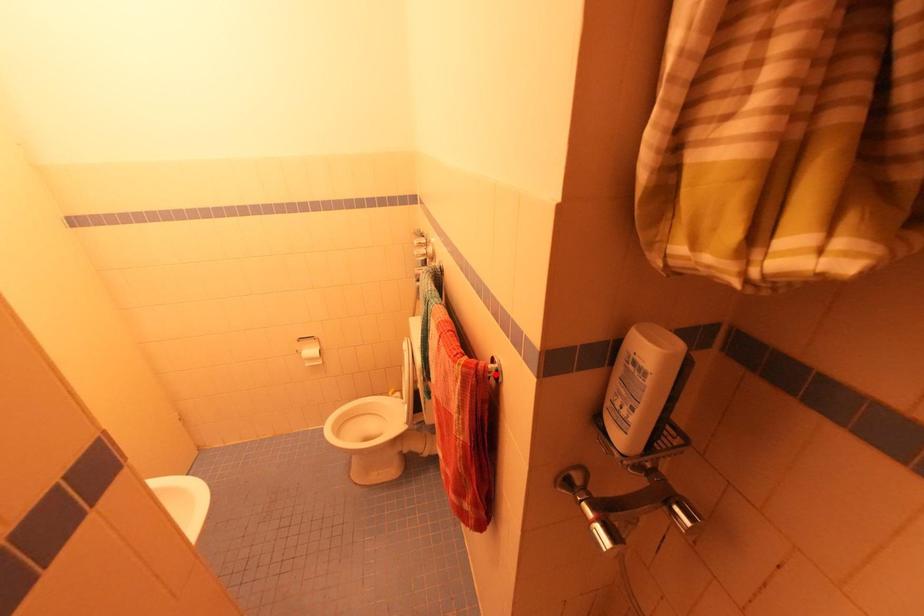
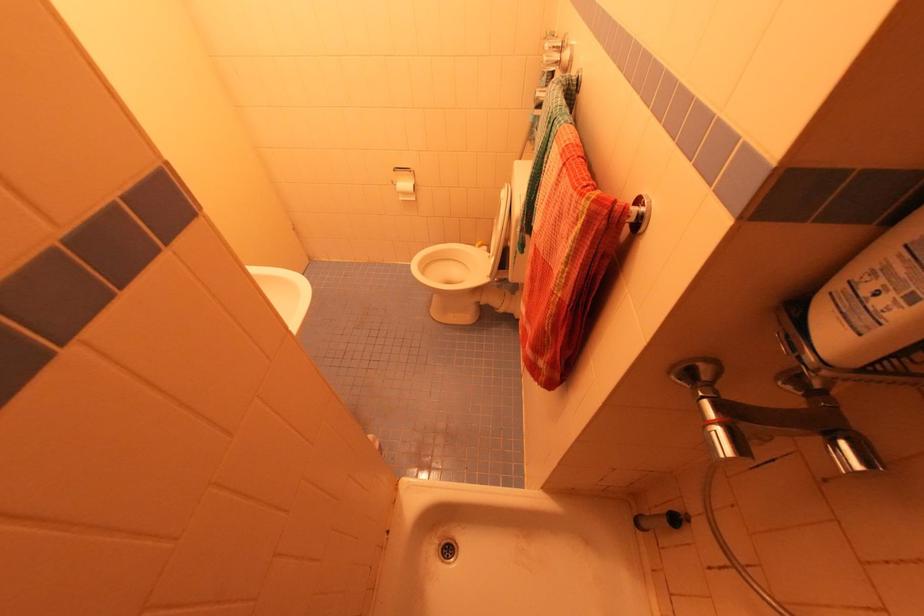
Where in the second image is the point corresponding to the highlighted location from the first image?

(635, 222)